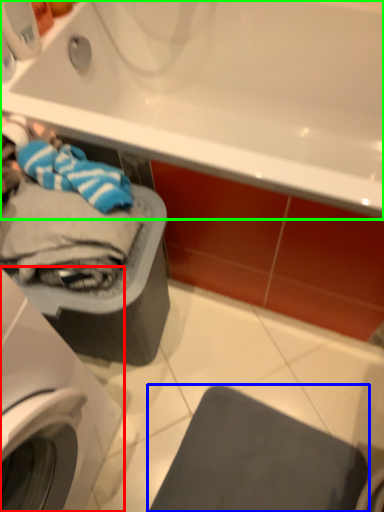
Question: Considering the real-world distances, which object is farthest from washing machine (highlighted by a red box)? gray (highlighted by a blue box) or bathtub (highlighted by a green box)?

Choices:
 (A) gray
 (B) bathtub

Answer: (B)